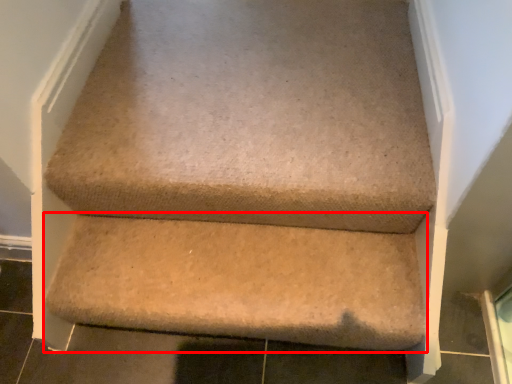
Question: From the image's perspective, where is stairwell (annotated by the red box) located relative to furniture?

Choices:
 (A) above
 (B) below

Answer: (B)